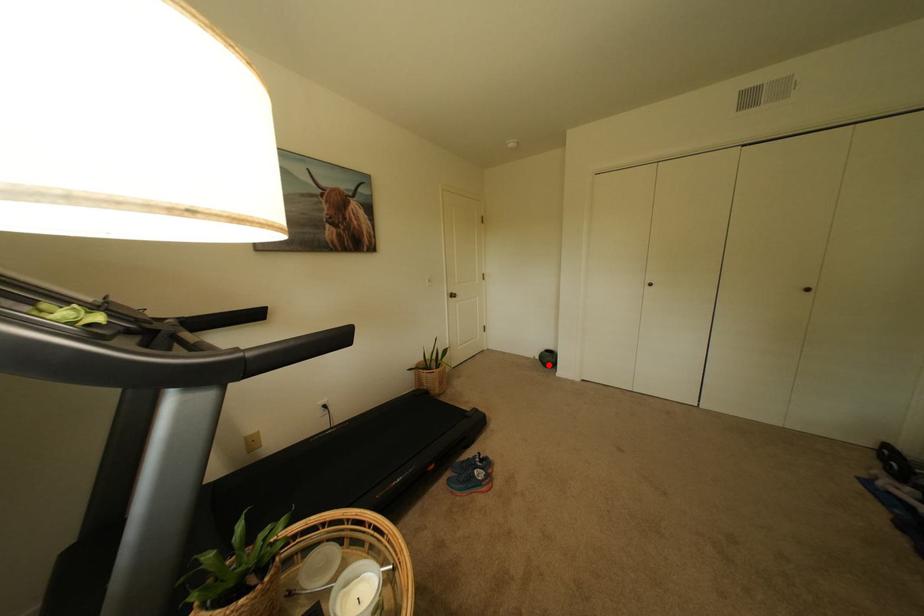
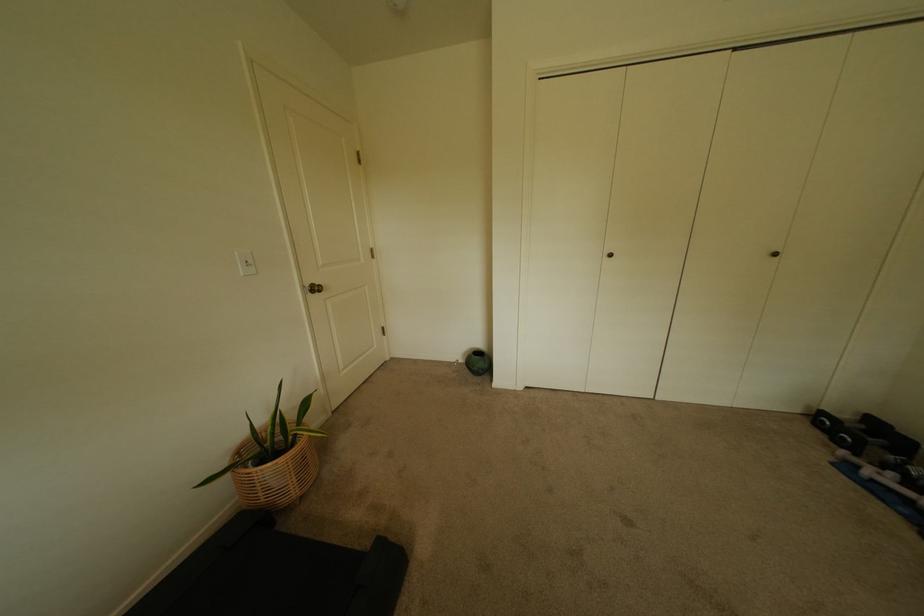
Question: I am providing you with two images of the same scene from different viewpoints. A red point is shown in image1. For the corresponding object point in image2, is it positioned nearer or farther from the camera?

Choices:
 (A) Nearer
 (B) Farther

Answer: (B)